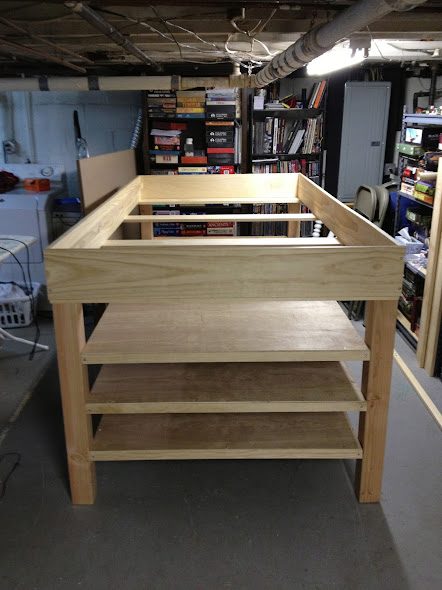
Identify the location of wooden board. The height and width of the screenshot is (590, 442). (263, 437).